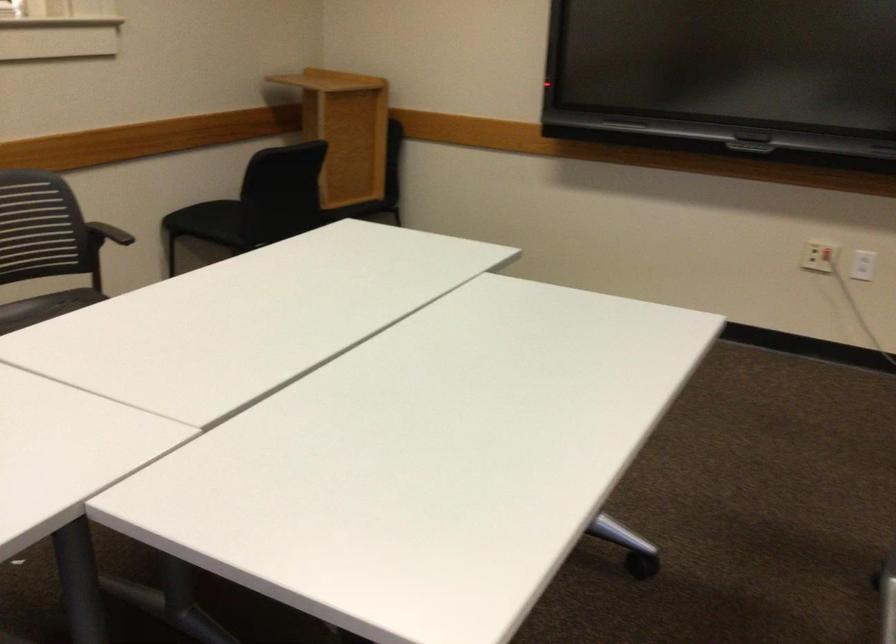
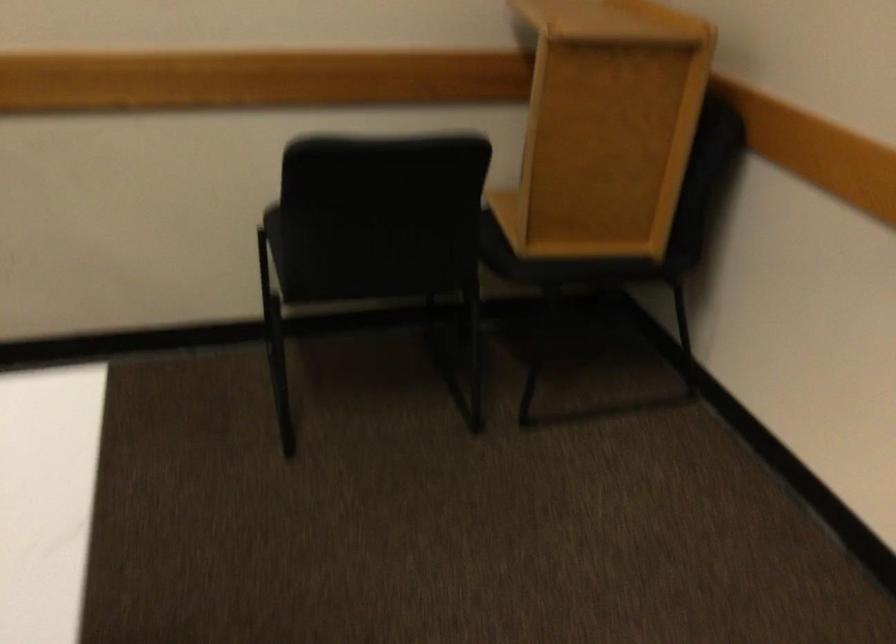
The point at (273, 213) is marked in the first image. Where is the corresponding point in the second image?

(348, 250)